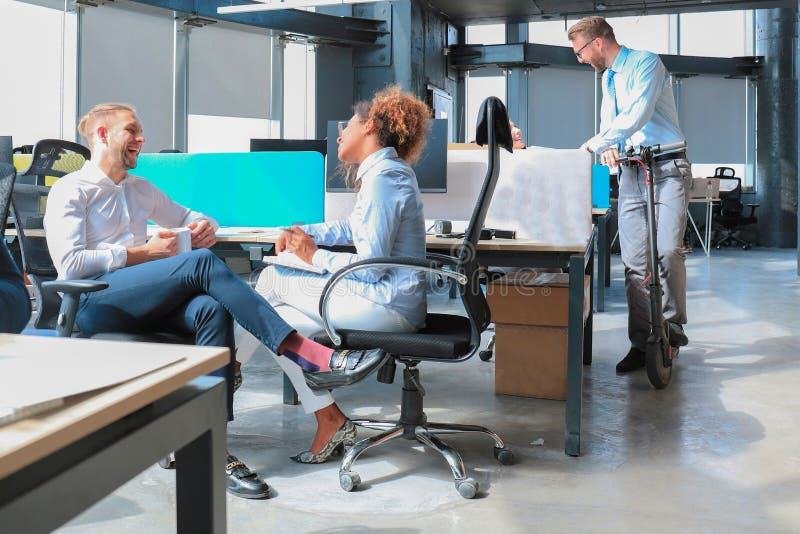
The width and height of the screenshot is (800, 534). Find the location of `shaded windows`. shaded windows is located at coordinates (234, 48), (328, 62), (126, 61), (26, 57), (544, 95), (718, 112), (474, 82).